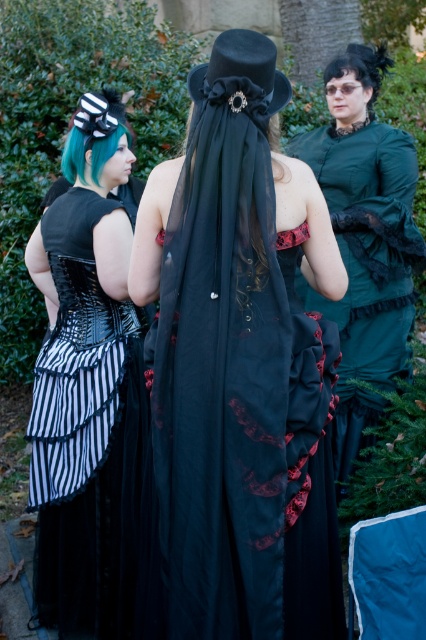
From the picture: Between matte black veil at center and velvet green dress at center, which one appears on the right side from the viewer's perspective?

velvet green dress at center is more to the right.

Describe the element at coordinates (241, 364) in the screenshot. I see `matte black veil at center` at that location.

At what (x,y) coordinates should I click in order to perform the action: click on matte black veil at center. Please return your answer as a coordinate pair (x, y). The width and height of the screenshot is (426, 640). Looking at the image, I should click on (241, 364).

What do you see at coordinates (88, 390) in the screenshot? This screenshot has width=426, height=640. I see `black striped fabric dress at left` at bounding box center [88, 390].

Does point (43, 252) lie in front of point (377, 250)?

Yes, point (43, 252) is closer to viewer.

Identify the location of black striped fabric dress at left. (88, 390).

Is point (232, 385) less distant than point (112, 129)?

Yes.

Can you confirm if matte black veil at center is positioned to the right of black striped fabric dress at left?

Correct, you'll find matte black veil at center to the right of black striped fabric dress at left.

The image size is (426, 640). Describe the element at coordinates (241, 364) in the screenshot. I see `matte black veil at center` at that location.

Locate an element on the screen. The height and width of the screenshot is (640, 426). matte black veil at center is located at coordinates pyautogui.click(x=241, y=364).